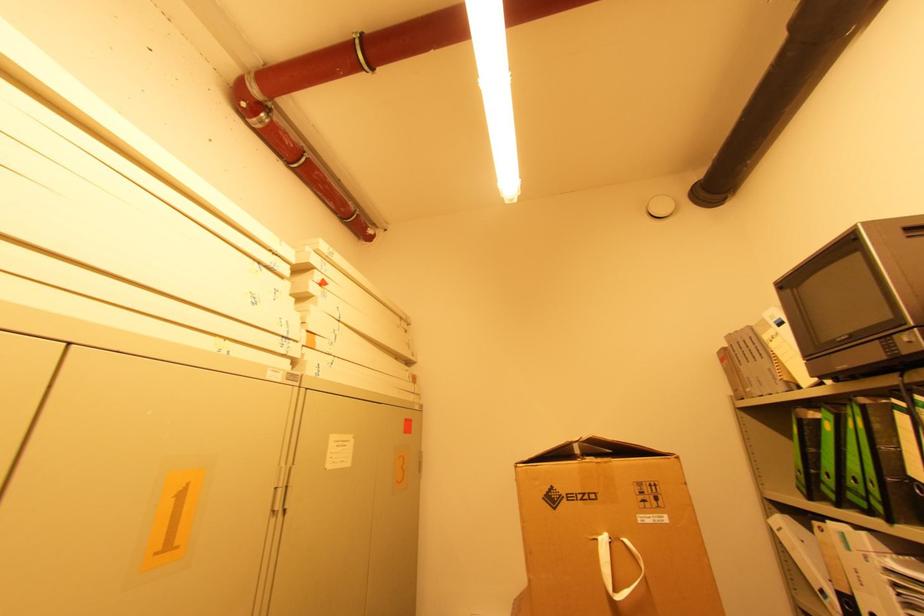
At what (x,y) coordinates should I click in order to perform the action: click on green ring binder. Please return your answer as a coordinate pair (x, y). This screenshot has width=924, height=616. Looking at the image, I should click on (842, 460).